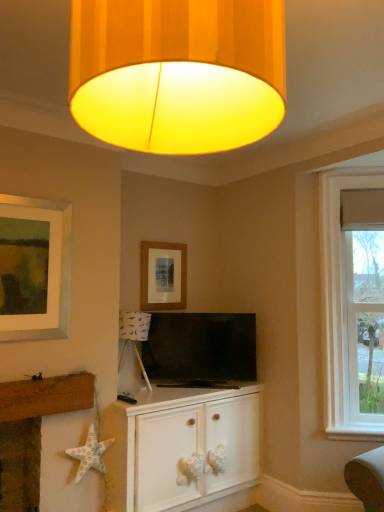
I want to click on blank space above white fabric starfish at lower left (from a real-world perspective), so click(72, 364).